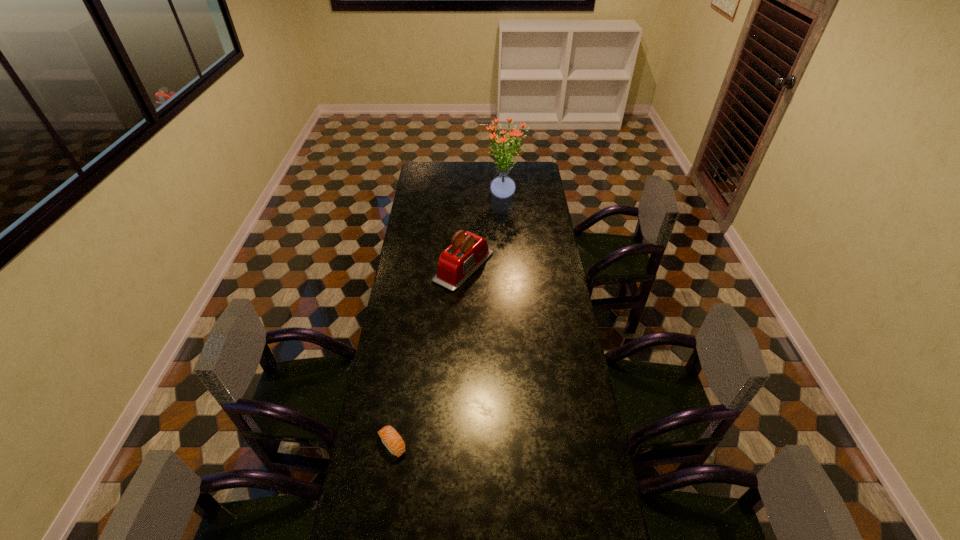
The width and height of the screenshot is (960, 540). What are the coordinates of `object present at the right edge` in the screenshot? It's located at (502, 187).

In the image, there is a desktop. Identify the location of free space at the far edge. (492, 165).

The image size is (960, 540). I want to click on vacant region at the left edge, so click(x=407, y=300).

This screenshot has height=540, width=960. What are the coordinates of `vacant region at the right edge of the desktop` in the screenshot? It's located at pos(547,394).

Locate an element on the screen. The image size is (960, 540). vacant region at the far right corner is located at coordinates (536, 165).

Image resolution: width=960 pixels, height=540 pixels. In order to click on free space between the flower arrangement and the sushi in this screenshot , I will do `click(448, 320)`.

Locate an element on the screen. Image resolution: width=960 pixels, height=540 pixels. free space between the second tallest object and the shortest object is located at coordinates (428, 356).

Where is `empty location between the second shortest object and the tallest object`? empty location between the second shortest object and the tallest object is located at coordinates (484, 231).

Locate an element on the screen. Image resolution: width=960 pixels, height=540 pixels. vacant area between the nearest object and the toaster is located at coordinates (428, 356).

This screenshot has width=960, height=540. What are the coordinates of `unoccupied position between the nearest object and the flower arrangement` in the screenshot? It's located at (448, 320).